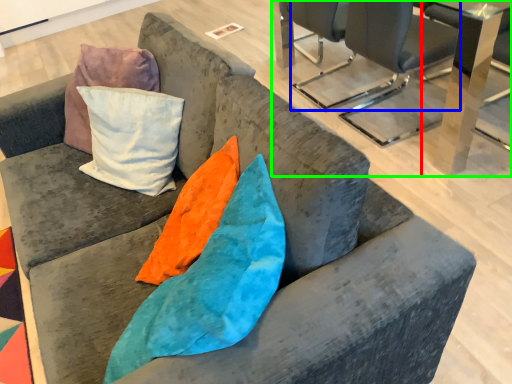
Question: Which is farther away from table (highlighted by a red box)? chair (highlighted by a blue box) or table (highlighted by a green box)?

Choices:
 (A) chair
 (B) table

Answer: (A)